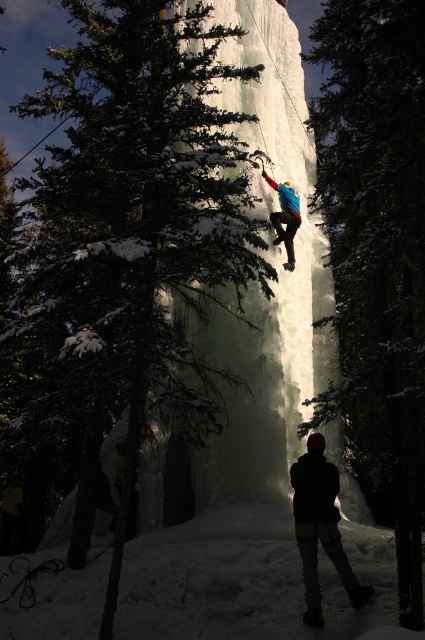
Question: Does green snow-covered tree at center appear on the left side of blue fabric snowboarder at center?

Choices:
 (A) no
 (B) yes

Answer: (B)

Question: Can you confirm if green snow-covered tree at center is bigger than dark fabric jacket at lower center?

Choices:
 (A) no
 (B) yes

Answer: (B)

Question: Among these points, which one is farthest from the camera?

Choices:
 (A) (197, 220)
 (B) (289, 228)
 (C) (323, 540)
 (D) (319, 52)

Answer: (B)

Question: Is green snow-covered tree at center smaller than green textured tree at center?

Choices:
 (A) yes
 (B) no

Answer: (B)

Question: Which point appears farthest from the camera in this image?

Choices:
 (A) (303, 476)
 (B) (272, 188)

Answer: (B)

Question: Among these objects, which one is farthest from the camera?

Choices:
 (A) green snow-covered tree at center
 (B) blue fabric snowboarder at center

Answer: (B)